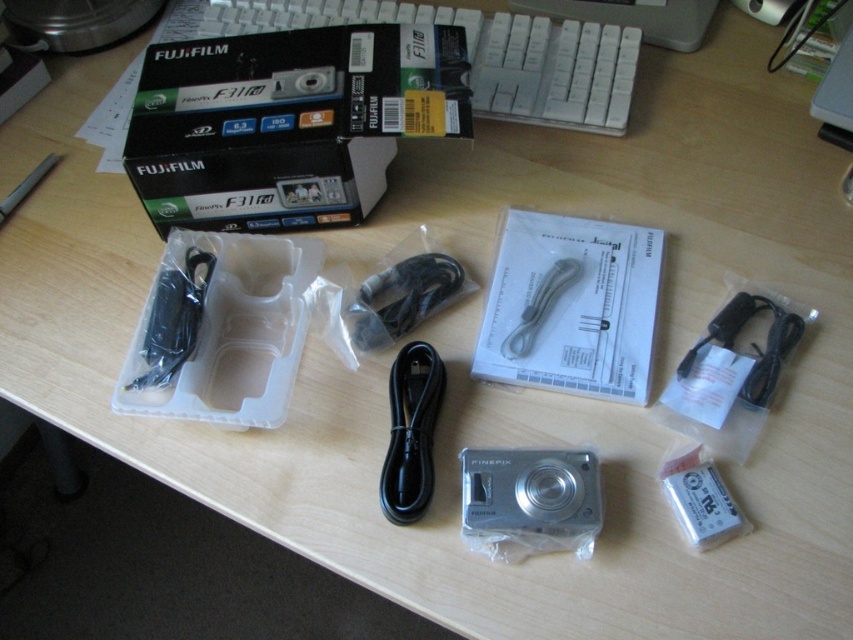
Question: Is silver metallic camera at center smaller than wooden at upper center?

Choices:
 (A) no
 (B) yes

Answer: (B)

Question: Can you confirm if white plastic keyboard at upper center is positioned above wooden at upper center?

Choices:
 (A) yes
 (B) no

Answer: (B)

Question: Is wooden at upper center to the left of black plastic charger at right from the viewer's perspective?

Choices:
 (A) yes
 (B) no

Answer: (A)

Question: Among these objects, which one is farthest from the camera?

Choices:
 (A) wooden at upper center
 (B) silver metallic camera at center
 (C) black cardboard box at upper center

Answer: (A)

Question: Which point is farther to the camera?

Choices:
 (A) (692, 353)
 (B) (541, 6)

Answer: (B)

Question: Among these points, which one is farthest from the camera?

Choices:
 (A) (654, 44)
 (B) (393, 51)
 (C) (573, 536)

Answer: (A)